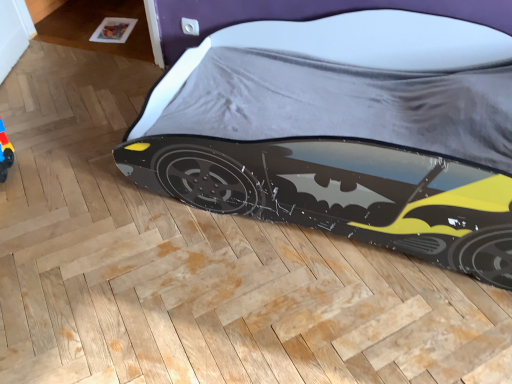
Find the location of a particular element. matt black car at lower right is located at coordinates (344, 132).

What is the approximate height of matt black car at lower right?

49.69 centimeters.

Describe the element at coordinates (344, 132) in the screenshot. I see `matt black car at lower right` at that location.

The image size is (512, 384). Identify the location of matt black car at lower right. (344, 132).